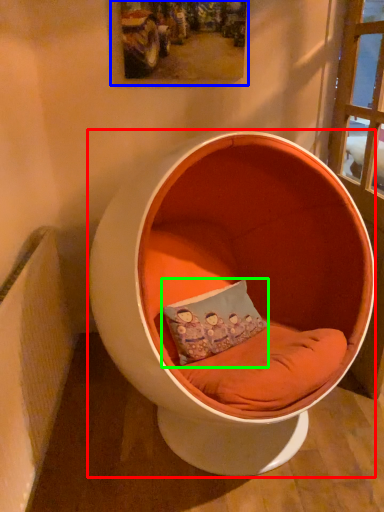
Question: Which is nearer to the furniture (highlighted by a red box)? picture frame (highlighted by a blue box) or pillow (highlighted by a green box).

Choices:
 (A) picture frame
 (B) pillow

Answer: (B)